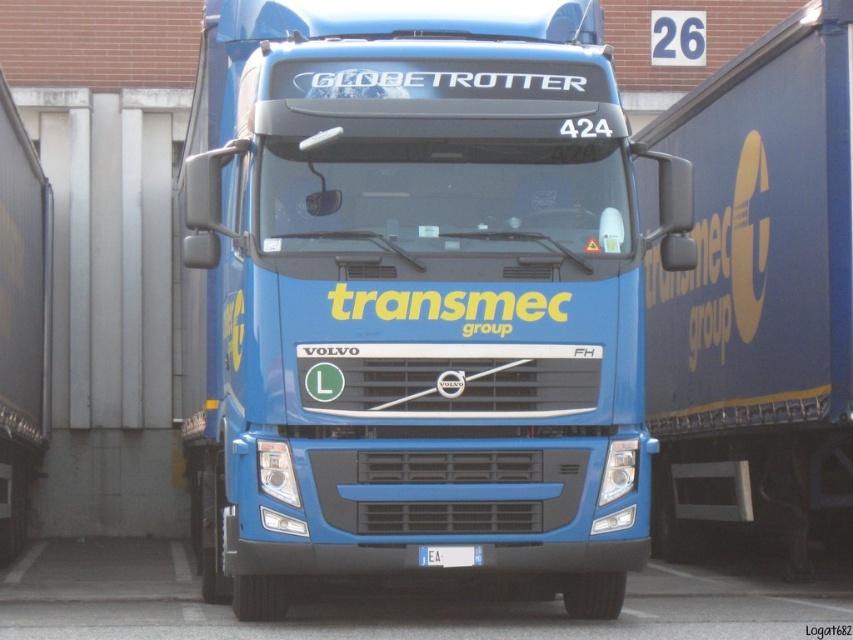
Question: Which point is closer to the camera?

Choices:
 (A) white plastic license plate at center
 (B) blue metallic truck at center

Answer: (B)

Question: Does blue metallic truck at center appear on the right side of white plastic license plate at center?

Choices:
 (A) no
 (B) yes

Answer: (A)

Question: Does blue metallic truck at center appear over white plastic license plate at center?

Choices:
 (A) yes
 (B) no

Answer: (A)

Question: Does blue metallic truck at center appear over blue matte trailer truck at right?

Choices:
 (A) yes
 (B) no

Answer: (B)

Question: Which object appears closest to the camera in this image?

Choices:
 (A) white plastic license plate at center
 (B) blue matte trailer truck at right

Answer: (A)

Question: Estimate the real-world distances between objects in this image. Which object is farther from the white plastic license plate at center?

Choices:
 (A) blue matte trailer truck at right
 (B) blue metallic truck at center

Answer: (A)